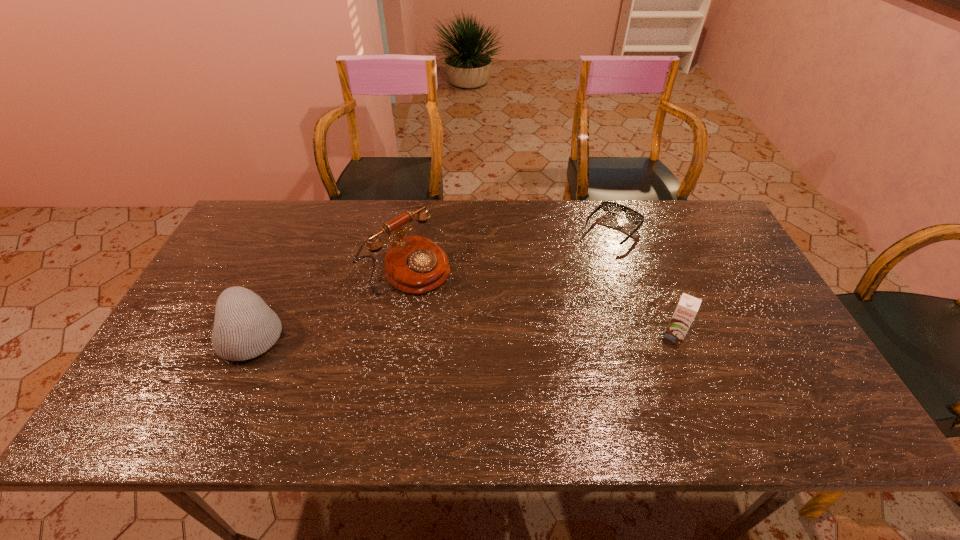
This screenshot has width=960, height=540. In order to click on object that is the closest to the chocolate milk in this screenshot , I will do `click(610, 208)`.

You are a GUI agent. You are given a task and a screenshot of the screen. Output one action in this format:
    pyautogui.click(x=<x>, y=<y>)
    Task: Click on the free location that satisfies the following two spatial constraints: 1. on the front side of the shortest object; 2. on the right side of the chocolate milk
    The width and height of the screenshot is (960, 540).
    Given the screenshot: What is the action you would take?
    pyautogui.click(x=646, y=335)

At what (x,y) coordinates should I click in order to perform the action: click on blank area in the image that satisfies the following two spatial constraints: 1. on the front side of the third object from right to left; 2. on the left side of the chocolate milk. Please return your answer as a coordinate pair (x, y). Image resolution: width=960 pixels, height=540 pixels. Looking at the image, I should click on (396, 335).